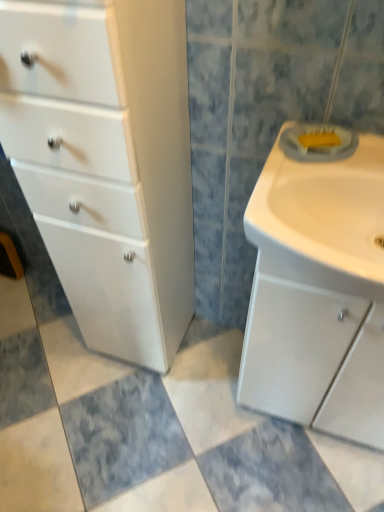
Where is `free space to the left of white matte sink cabinet at right`? The height and width of the screenshot is (512, 384). free space to the left of white matte sink cabinet at right is located at coordinates (208, 413).